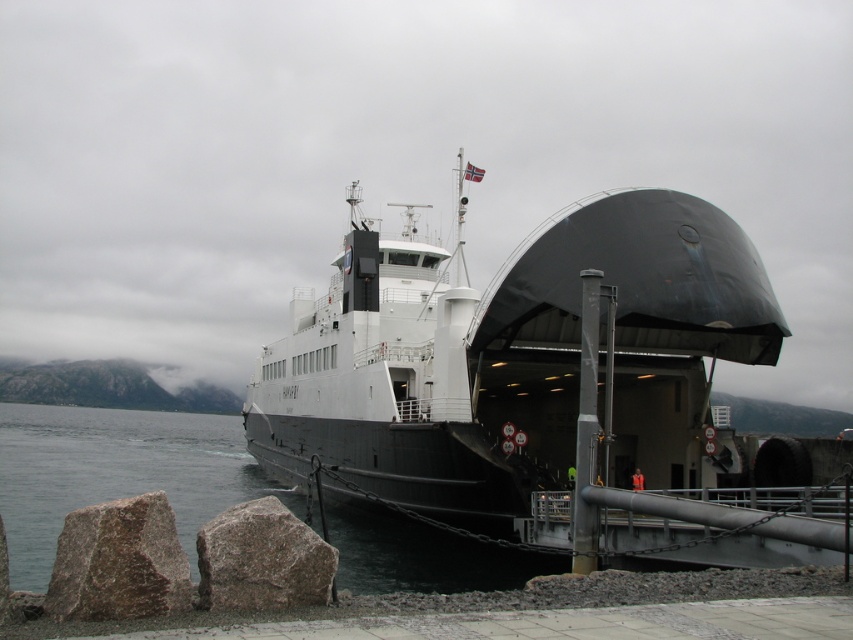
Question: Which point appears closest to the camera in this image?

Choices:
 (A) (380, 545)
 (B) (328, 600)
 (C) (158, 534)
 (D) (440, 417)

Answer: (C)

Question: Observing the image, what is the correct spatial positioning of black matte ship at center in reference to granite rock at lower left?

Choices:
 (A) left
 (B) right

Answer: (B)

Question: Considering the relative positions of black matte ship at center and granite rock at lower left in the image provided, where is black matte ship at center located with respect to granite rock at lower left?

Choices:
 (A) above
 (B) below

Answer: (A)

Question: Among these objects, which one is nearest to the camera?

Choices:
 (A) black matte ship at center
 (B) clear water at lower left
 (C) granite rock at lower left
 (D) brown rough rock at lower left

Answer: (D)

Question: Does black matte ship at center appear on the right side of clear water at lower left?

Choices:
 (A) no
 (B) yes

Answer: (B)

Question: Among these objects, which one is farthest from the camera?

Choices:
 (A) black matte ship at center
 (B) brown rough rock at lower left
 (C) granite rock at lower left
 (D) clear water at lower left

Answer: (A)